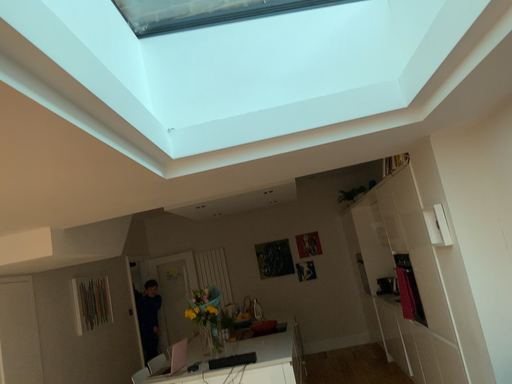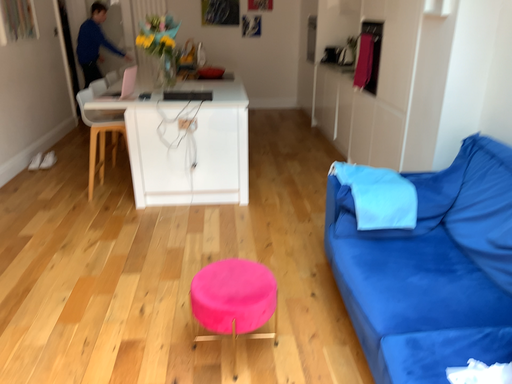
Question: How did the camera likely rotate when shooting the video?

Choices:
 (A) rotated right
 (B) rotated left

Answer: (A)